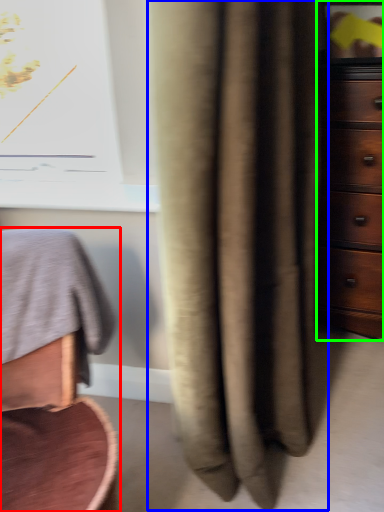
Question: Which object is the farthest from furniture (highlighted by a red box)? Choose among these: curtain (highlighted by a blue box) or chest of drawers (highlighted by a green box).

Choices:
 (A) curtain
 (B) chest of drawers

Answer: (B)